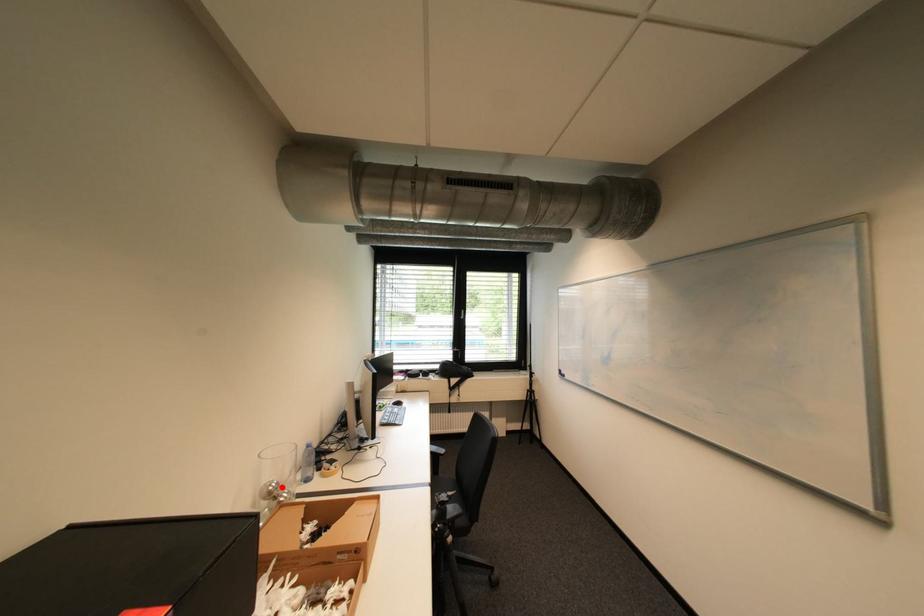
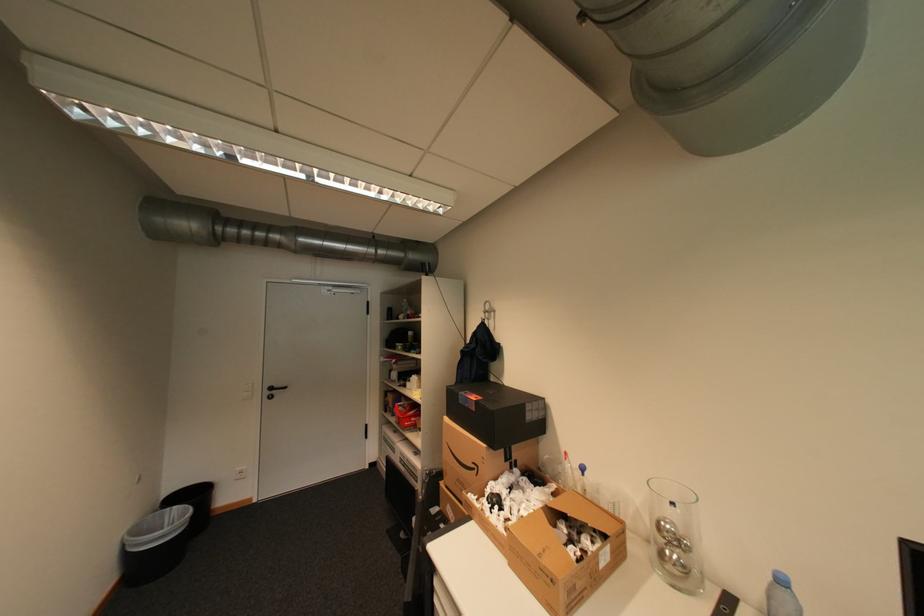
The point at the highlighted location is marked in the first image. Where is the corresponding point in the second image?

(673, 527)